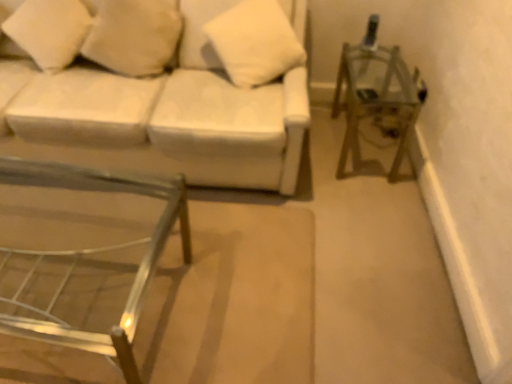
Question: Based on their sizes in the image, would you say metallic silver table at lower left is bigger or smaller than white soft pillow at upper left, arranged as the second pillow when viewed from the left?

Choices:
 (A) small
 (B) big

Answer: (B)

Question: From the image's perspective, is metallic silver table at lower left located above or below white soft pillow at upper left, the second pillow viewed from the right?

Choices:
 (A) below
 (B) above

Answer: (A)

Question: Estimate the real-world distances between objects in this image. Which object is farther from the metallic silver side table at right?

Choices:
 (A) white soft pillow at upper left, the second pillow viewed from the right
 (B) white fabric couch at upper left
 (C) white soft pillow at upper center, which is the 3th pillow in left-to-right order
 (D) white soft pillow at upper left, acting as the first pillow starting from the left
 (E) metallic silver table at lower left

Answer: (D)

Question: Which object is positioned farthest from the white soft pillow at upper left, arranged as the second pillow when viewed from the left?

Choices:
 (A) metallic silver side table at right
 (B) metallic silver table at lower left
 (C) white soft pillow at upper left, marked as the 3th pillow in a right-to-left arrangement
 (D) white soft pillow at upper center, arranged as the 1th pillow when viewed from the right
 (E) white fabric couch at upper left

Answer: (A)